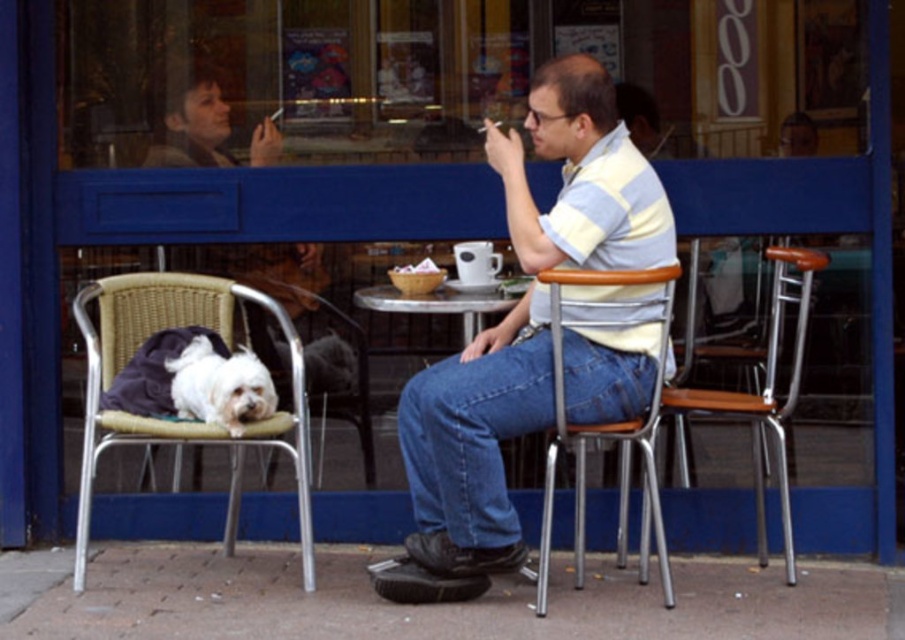
Can you confirm if woven wicker chair at left is positioned below white fur dog at left?

Correct, woven wicker chair at left is located below white fur dog at left.

Does woven wicker chair at left appear over white fur dog at left?

Actually, woven wicker chair at left is below white fur dog at left.

This screenshot has height=640, width=905. What do you see at coordinates (169, 420) in the screenshot? I see `woven wicker chair at left` at bounding box center [169, 420].

At what (x,y) coordinates should I click in order to perform the action: click on woven wicker chair at left. Please return your answer as a coordinate pair (x, y). The image size is (905, 640). Looking at the image, I should click on (169, 420).

Is metal/wooden chair at center positioned in front of matte black jacket at upper left?

That is True.

Which of these two, metal/wooden chair at center or matte black jacket at upper left, stands shorter?

matte black jacket at upper left

Does point (668, 307) lie behind point (208, 140)?

No, (668, 307) is closer to viewer.

Find the location of a particular element. metal/wooden chair at center is located at coordinates (605, 422).

Does point (757, 403) come closer to viewer compared to point (450, 289)?

Yes, point (757, 403) is closer to viewer.

Which is more to the left, wooden seat at right or metallic silver table at center?

Positioned to the left is metallic silver table at center.

Who is more forward, [775,333] or [407,308]?

Point [775,333] is more forward.

Where is `wooden seat at right`? The height and width of the screenshot is (640, 905). wooden seat at right is located at coordinates (765, 392).